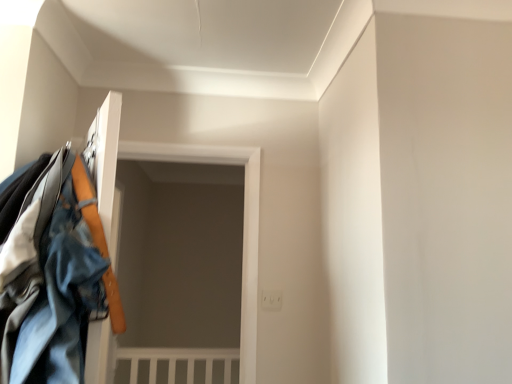
You are a GUI agent. You are given a task and a screenshot of the screen. Output one action in this format:
    pyautogui.click(x=<x>, y=<y>)
    Task: Click on the denim jacket at left
    The image size is (512, 384).
    Given the screenshot: What is the action you would take?
    pyautogui.click(x=106, y=167)

Describe the element at coordinates (106, 167) in the screenshot. I see `denim jacket at left` at that location.

Describe the element at coordinates (106, 167) in the screenshot. The image size is (512, 384). I see `denim jacket at left` at that location.

Image resolution: width=512 pixels, height=384 pixels. I want to click on denim jacket at left, so click(106, 167).

I want to click on denim jacket at left, so click(106, 167).

Is denim jacket at left to the right of denim jacket at left from the viewer's perspective?

Yes, denim jacket at left is to the right of denim jacket at left.

Does denim jacket at left lie in front of denim jacket at left?

Yes, the depth of denim jacket at left is less than that of denim jacket at left.

Which is farther, (113,146) or (113,131)?

Point (113,146)

From the image's perspective, is denim jacket at left under denim jacket at left?

No, from the image's perspective, denim jacket at left is not beneath denim jacket at left.

From a real-world perspective, does denim jacket at left sit lower than denim jacket at left?

Correct, in the physical world, denim jacket at left is lower than denim jacket at left.

Is denim jacket at left thinner than denim jacket at left?

No.

Does denim jacket at left have a greater height compared to denim jacket at left?

No.

Who is bigger, denim jacket at left or denim jacket at left?

Bigger between the two is denim jacket at left.

Would you say denim jacket at left is inside or outside denim jacket at left?

denim jacket at left exists outside the volume of denim jacket at left.

Are denim jacket at left and denim jacket at left making contact?

Yes, denim jacket at left is right next to denim jacket at left and making contact.

Is denim jacket at left oriented away from denim jacket at left?

Correct, denim jacket at left is looking away from denim jacket at left.

You are a GUI agent. You are given a task and a screenshot of the screen. Output one action in this format:
    pyautogui.click(x=<x>, y=<y>)
    Task: Click on the closet in front of the denim jacket at left
    The width and height of the screenshot is (512, 384).
    Given the screenshot: What is the action you would take?
    pyautogui.click(x=106, y=167)

Which object is positioned more to the left, denim jacket at left or denim jacket at left?

denim jacket at left is more to the left.

Considering their positions, is denim jacket at left located in front of or behind denim jacket at left?

Clearly, denim jacket at left is behind denim jacket at left.

Considering the points (86, 373) and (96, 146), which point is behind, point (86, 373) or point (96, 146)?

The point (96, 146) is farther.

From the image's perspective, who appears lower, denim jacket at left or denim jacket at left?

From the image's view, denim jacket at left is below.

From a real-world perspective, is denim jacket at left on denim jacket at left?

Indeed, from a real-world perspective, denim jacket at left stands above denim jacket at left.

Which of these two, denim jacket at left or denim jacket at left, is wider?

Wider between the two is denim jacket at left.

Which of these two, denim jacket at left or denim jacket at left, stands taller?

denim jacket at left is taller.

Is denim jacket at left smaller than denim jacket at left?

Yes.

Would you say denim jacket at left is inside or outside denim jacket at left?

denim jacket at left lies outside denim jacket at left.

Is denim jacket at left in contact with denim jacket at left?

Yes, the surface of denim jacket at left is in contact with denim jacket at left.

Is denim jacket at left turned away from denim jacket at left?

That's not correct — denim jacket at left is not looking away from denim jacket at left.

Can you tell me how much denim jacket at left and denim jacket at left differ in facing direction?

There is a 122-degree angle between the facing directions of denim jacket at left and denim jacket at left.

Locate an element on the screen. This screenshot has height=384, width=512. closet that is above the denim jacket at left (from the image's perspective) is located at coordinates (106, 167).

The width and height of the screenshot is (512, 384). Identify the location of door above the denim jacket at left (from a real-world perspective). (106, 167).

Identify the location of closet on the right side of denim jacket at left. (106, 167).